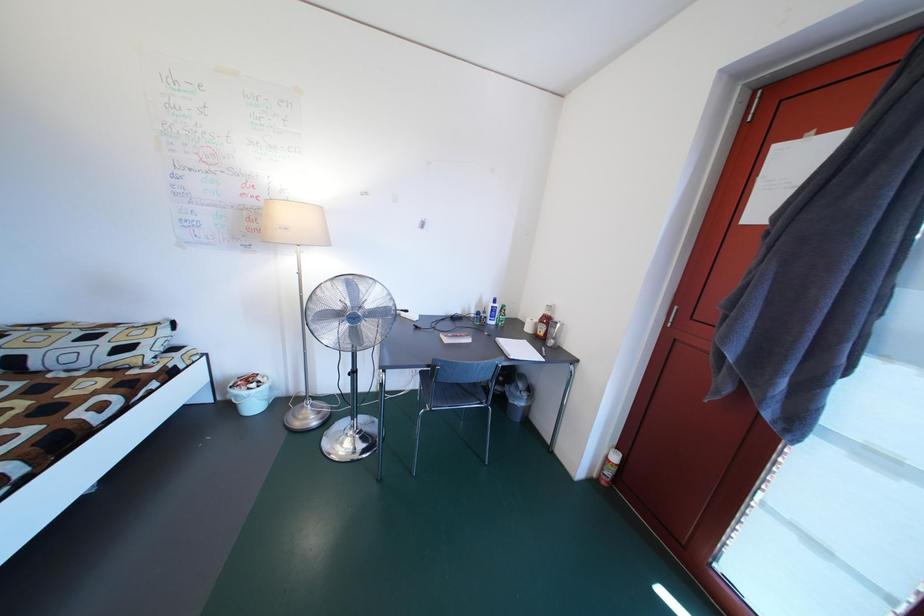
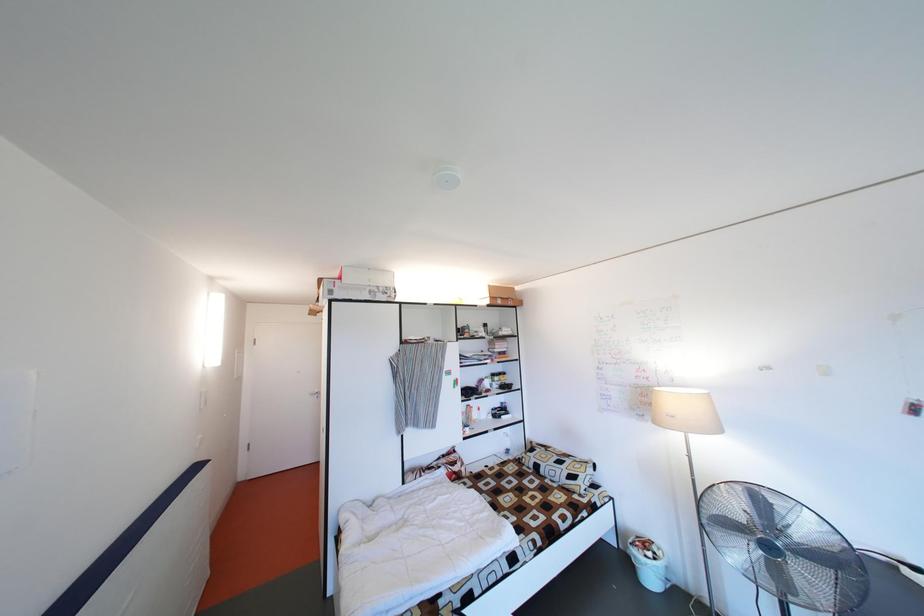
First-person continuous shooting, in which direction is the camera rotating?

The camera rotated toward left-up.